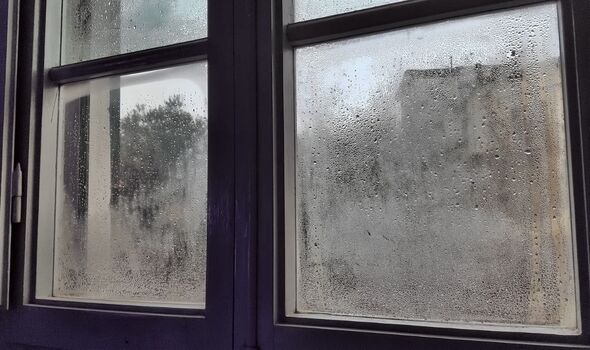
Find the location of a particular element. This screenshot has height=350, width=590. the right windows is located at coordinates (409, 207), (317, 7).